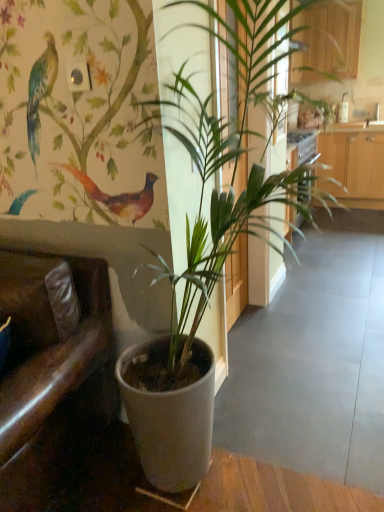
Question: Is wooden cabinet at upper right wider or thinner than brown leather armchair at left?

Choices:
 (A) wide
 (B) thin

Answer: (B)

Question: From the image's perspective, is wooden cabinet at upper right above or below brown leather armchair at left?

Choices:
 (A) above
 (B) below

Answer: (A)

Question: Which of these objects is positioned farthest from the green matte plant at center?

Choices:
 (A) wooden cabinet at upper right
 (B) brown leather armchair at left

Answer: (A)

Question: Which object is the farthest from the brown leather armchair at left?

Choices:
 (A) wooden cabinet at upper right
 (B) green matte plant at center

Answer: (A)